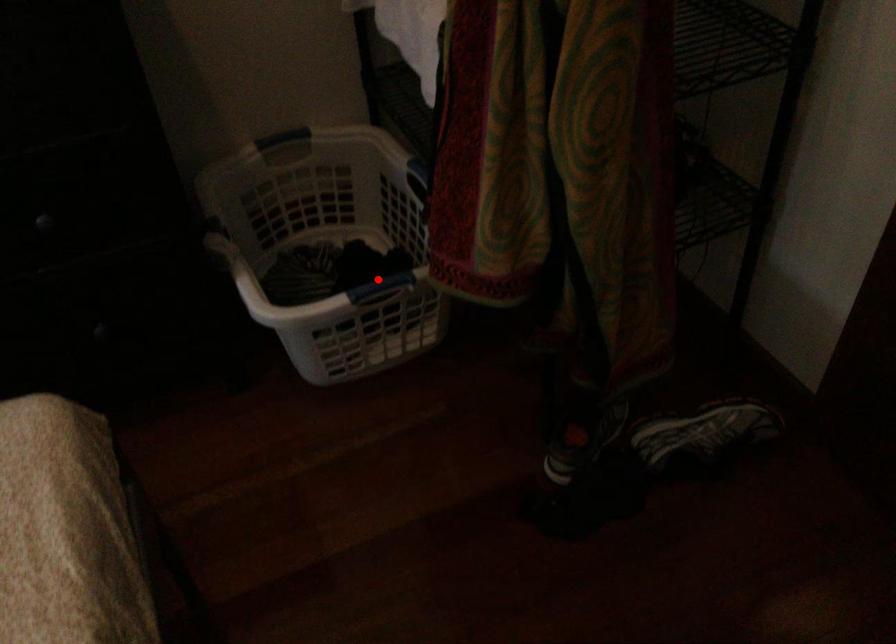
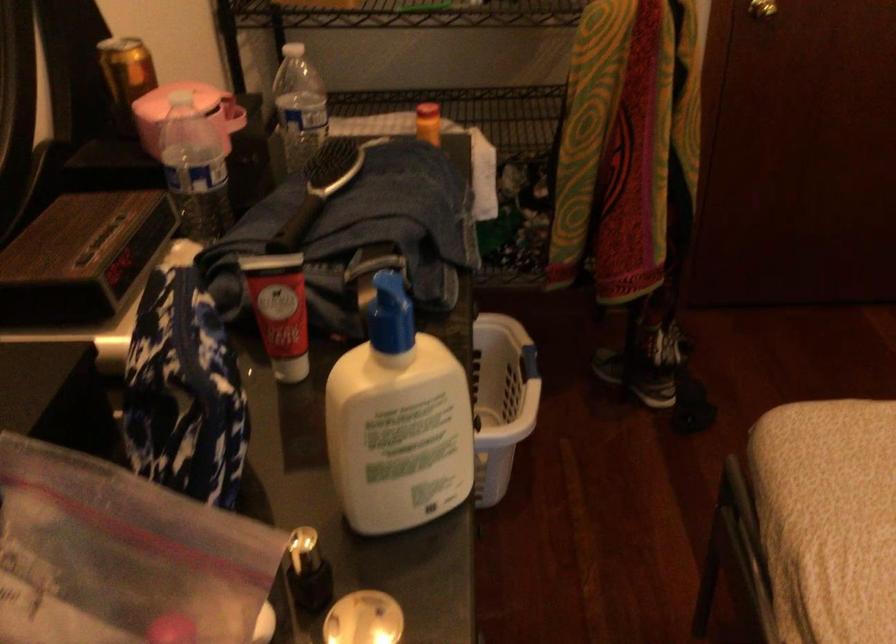
Question: I am providing you with two images of the same scene from different viewpoints. In image1, a red point is highlighted. Considering the same 3D point in image2, which of the following is correct?

Choices:
 (A) It is closer
 (B) It is farther

Answer: (B)